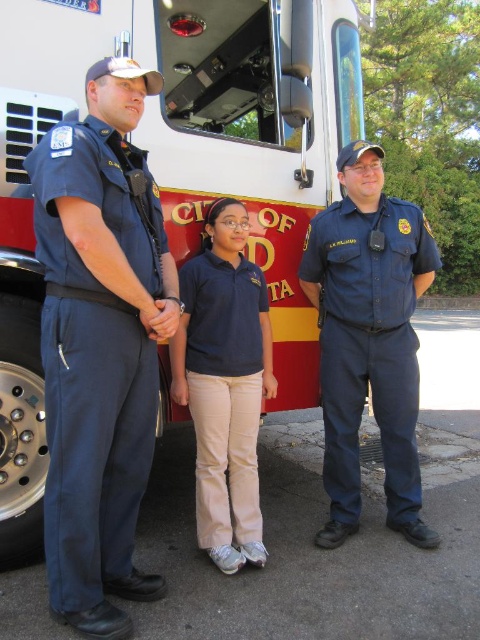
Question: Among these points, which one is nearest to the camera?

Choices:
 (A) (141, 499)
 (B) (201, 330)
 (C) (310, 102)

Answer: (A)

Question: Observing the image, what is the correct spatial positioning of red and white fire truck at center in reference to navy blue cotton shirt at center?

Choices:
 (A) left
 (B) right

Answer: (A)

Question: Which of the following is the farthest from the observer?

Choices:
 (A) (204, 476)
 (B) (324, 404)
 (C) (199, 54)
 (D) (113, 189)

Answer: (C)

Question: Which point is closer to the camera taking this photo?

Choices:
 (A) (339, 144)
 (B) (184, 278)

Answer: (B)

Question: Is navy blue uniform at left above navy blue cotton shirt at center?

Choices:
 (A) yes
 (B) no

Answer: (A)

Question: Is red and white fire truck at center wider than blue cotton shirt at center?

Choices:
 (A) no
 (B) yes

Answer: (B)